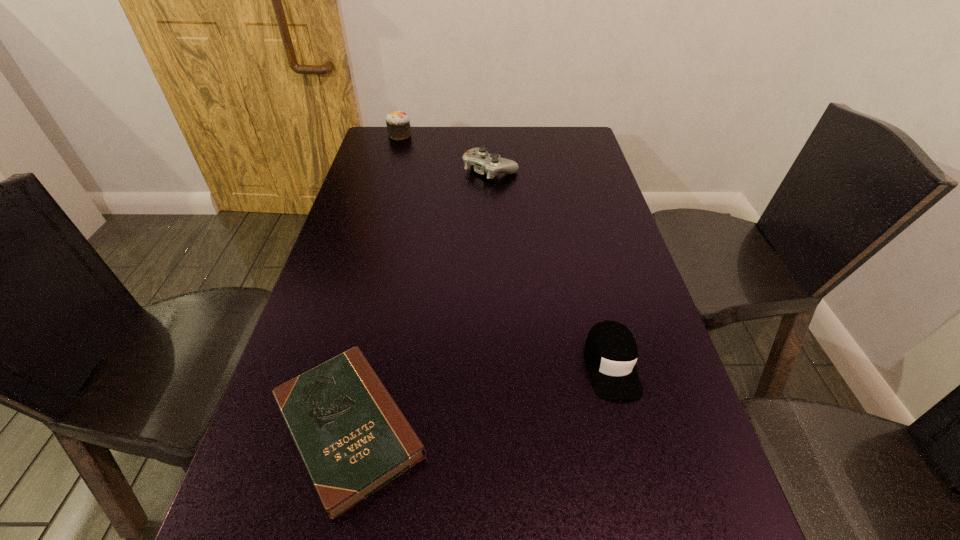
The image size is (960, 540). In order to click on free space that is in between the control and the cap in this screenshot , I will do `click(551, 267)`.

Identify the location of object that is the third closest to the second object from right to left. Image resolution: width=960 pixels, height=540 pixels. (353, 439).

You are a GUI agent. You are given a task and a screenshot of the screen. Output one action in this format:
    pyautogui.click(x=<x>, y=<y>)
    Task: Click on the third closest object to the cap
    This screenshot has height=540, width=960.
    Given the screenshot: What is the action you would take?
    pyautogui.click(x=398, y=126)

At what (x,y) coordinates should I click in order to perform the action: click on free point that satisfies the following two spatial constraints: 1. on the back side of the third nearest object; 2. on the left side of the shortest object. Please return your answer as a coordinate pair (x, y). The width and height of the screenshot is (960, 540). Looking at the image, I should click on (408, 170).

Find the location of `vacant space that satisfies the following two spatial constraints: 1. on the front side of the Bible; 2. on the left side of the farthest object`. vacant space that satisfies the following two spatial constraints: 1. on the front side of the Bible; 2. on the left side of the farthest object is located at coordinates (318, 427).

You are a GUI agent. You are given a task and a screenshot of the screen. Output one action in this format:
    pyautogui.click(x=<x>, y=<y>)
    Task: Click on the free spot that satisfies the following two spatial constraints: 1. on the front side of the tallest object; 2. on the right side of the Bible
    The height and width of the screenshot is (540, 960).
    Given the screenshot: What is the action you would take?
    pyautogui.click(x=318, y=427)

The image size is (960, 540). What are the coordinates of `free space in the image that satisfies the following two spatial constraints: 1. on the back side of the control; 2. on the right side of the Bible` in the screenshot? It's located at (408, 170).